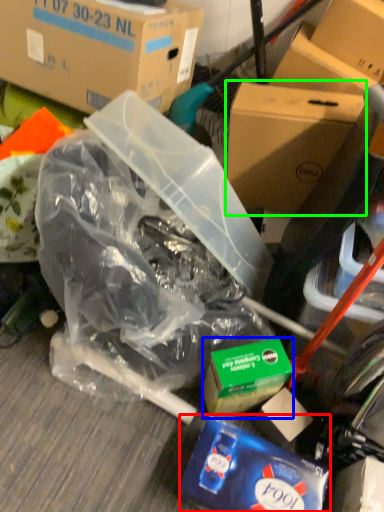
Question: Estimate the real-world distances between objects in this image. Which object is closer to waste (highlighted by a red box), product (highlighted by a blue box) or box (highlighted by a green box)?

Choices:
 (A) product
 (B) box

Answer: (A)